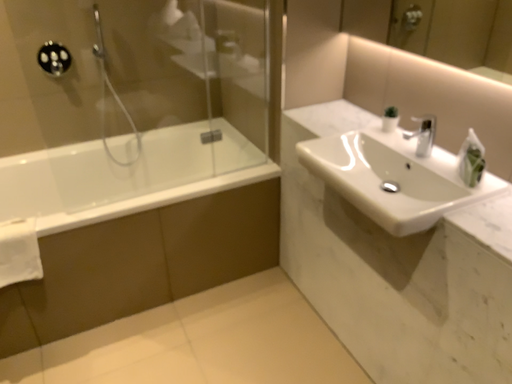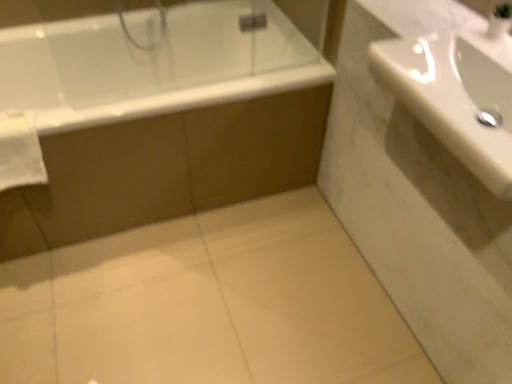
Question: Which way did the camera rotate in the video?

Choices:
 (A) rotated upward
 (B) rotated downward

Answer: (B)